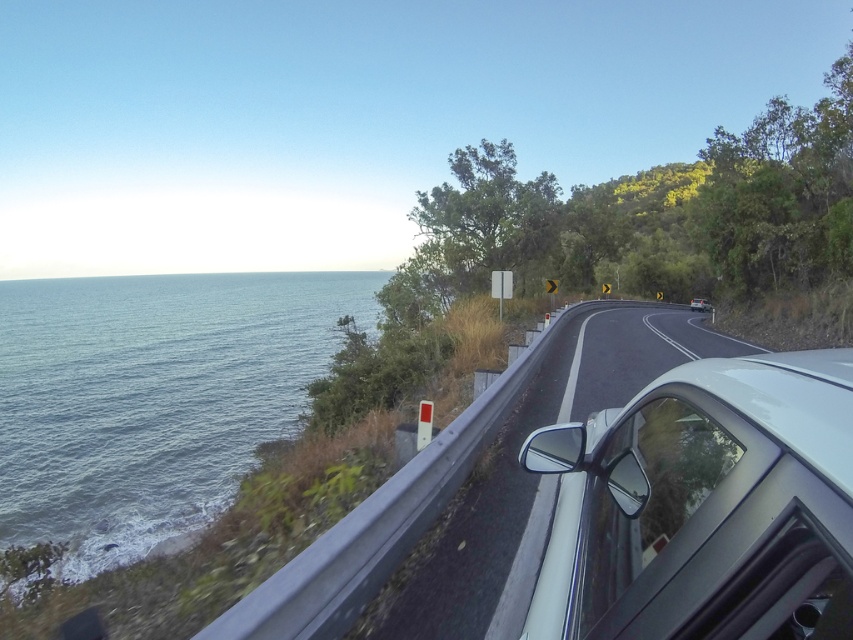
Is blue water at left shorter than metallic silver car at center?

In fact, blue water at left may be taller than metallic silver car at center.

Based on the photo, between blue water at left and metallic silver car at center, which one is positioned higher?

blue water at left

Image resolution: width=853 pixels, height=640 pixels. What do you see at coordinates (152, 397) in the screenshot?
I see `blue water at left` at bounding box center [152, 397].

The image size is (853, 640). I want to click on blue water at left, so 152,397.

Which is more to the left, white glossy car at right or blue water at left?

From the viewer's perspective, blue water at left appears more on the left side.

Does white glossy car at right have a lesser width compared to blue water at left?

Correct, white glossy car at right's width is less than blue water at left's.

Describe the element at coordinates (704, 506) in the screenshot. Image resolution: width=853 pixels, height=640 pixels. I see `white glossy car at right` at that location.

Find the location of a particular element. white glossy car at right is located at coordinates (704, 506).

Can you confirm if blue water at left is positioned above white glossy car at center-right?

Correct, blue water at left is located above white glossy car at center-right.

Does blue water at left have a larger size compared to white glossy car at center-right?

Correct, blue water at left is larger in size than white glossy car at center-right.

Who is more distant from viewer, (57, 413) or (706, 308)?

The point (706, 308) is more distant.

This screenshot has height=640, width=853. I want to click on blue water at left, so click(x=152, y=397).